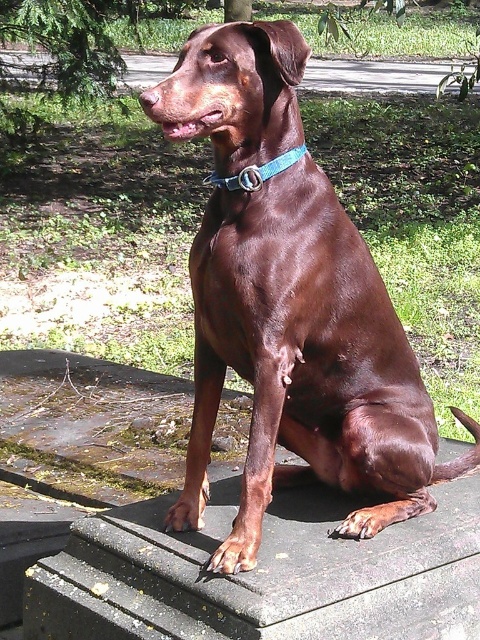
The height and width of the screenshot is (640, 480). Identify the location of shiny brown dog at center. click(304, 362).

Does shiny brown dog at center have a greater width compared to smooth concrete ledge at center?

No.

Locate an element on the screen. The height and width of the screenshot is (640, 480). shiny brown dog at center is located at coordinates (304, 362).

This screenshot has width=480, height=640. I want to click on shiny brown dog at center, so click(304, 362).

Between shiny brown dog at center and teal fabric collar at center, which one has less height?

With less height is teal fabric collar at center.

Which is behind, point (314, 256) or point (276, 161)?

The point (314, 256) is behind.

At what (x,y) coordinates should I click in order to perform the action: click on shiny brown dog at center. Please return your answer as a coordinate pair (x, y). Image resolution: width=480 pixels, height=640 pixels. Looking at the image, I should click on (304, 362).

Does smooth concrete ledge at center have a lesser width compared to teal fabric collar at center?

In fact, smooth concrete ledge at center might be wider than teal fabric collar at center.

Does point (446, 449) lie behind point (288, 161)?

Yes.

Find the location of `smooth concrete ledge at center`. smooth concrete ledge at center is located at coordinates (264, 573).